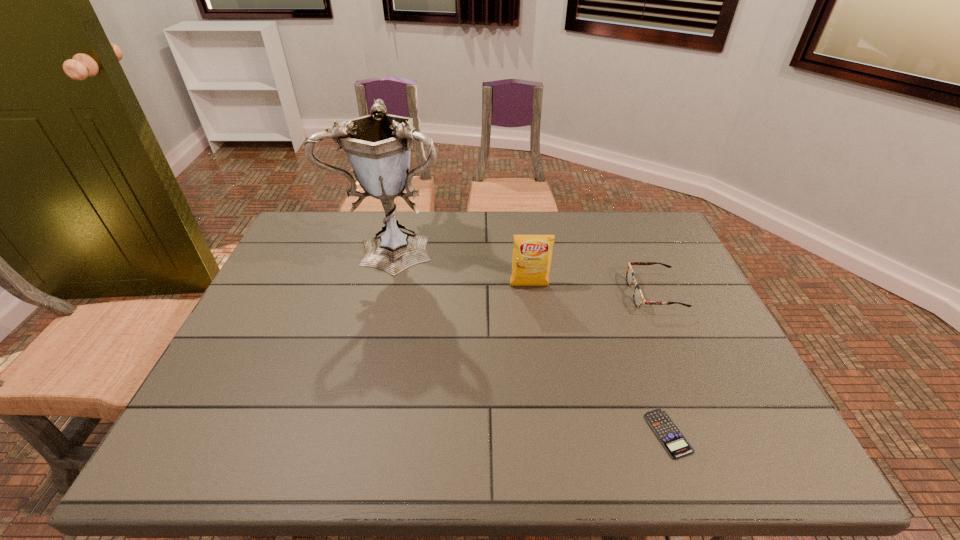
You are a GUI agent. You are given a task and a screenshot of the screen. Output one action in this format:
    pyautogui.click(x=<x>, y=<y>)
    Task: Click on the trophy cup
    
    Given the screenshot: What is the action you would take?
    pyautogui.click(x=378, y=146)

Find the location of a particular element. The height and width of the screenshot is (540, 960). the leftmost object is located at coordinates (378, 146).

The image size is (960, 540). In order to click on crisp (potato chip) in this screenshot , I will do `click(532, 254)`.

This screenshot has width=960, height=540. I want to click on the third shortest object, so click(532, 254).

Find the location of a particular element. the third tallest object is located at coordinates (638, 298).

Where is `calculator`? calculator is located at coordinates (672, 439).

At what (x,y) coordinates should I click in order to perform the action: click on the nearest object. Please return your answer as a coordinate pair (x, y). The width and height of the screenshot is (960, 540). Looking at the image, I should click on (672, 439).

Identify the location of vacant space located on the right of the tallest object. This screenshot has width=960, height=540. (534, 245).

The height and width of the screenshot is (540, 960). I want to click on vacant region located on the front of the third object from right to left with the logo, so click(545, 412).

This screenshot has width=960, height=540. Find the location of `free location located on the frame of the spectacles`. free location located on the frame of the spectacles is located at coordinates (519, 293).